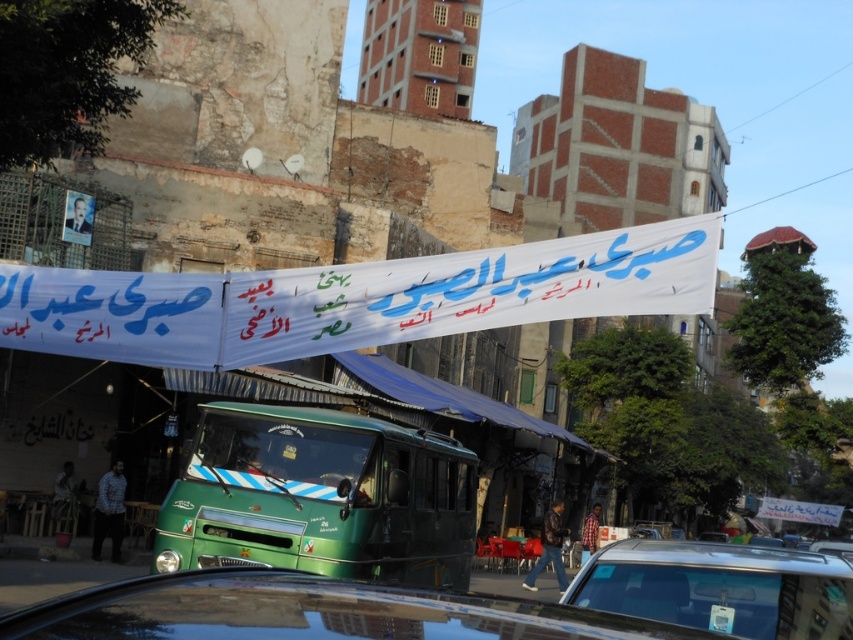
Is point (465, 472) closer to camera compared to point (650, 589)?

No.

Is green matte bus at center positioned in front of shiny black car at lower right?

No, it is behind shiny black car at lower right.

Describe the element at coordinates (320, 497) in the screenshot. I see `green matte bus at center` at that location.

The width and height of the screenshot is (853, 640). Find the location of `green matte bus at center`. green matte bus at center is located at coordinates (320, 497).

Is point (680, 637) positioned before point (741, 604)?

Yes, it is in front of point (741, 604).

Describe the element at coordinates (306, 612) in the screenshot. The height and width of the screenshot is (640, 853). I see `glossy black car at center` at that location.

The image size is (853, 640). I want to click on glossy black car at center, so click(306, 612).

Is green matte bus at center to the right of glossy black car at center from the viewer's perspective?

In fact, green matte bus at center is to the left of glossy black car at center.

Who is more forward, [236,456] or [401,589]?

Point [401,589] is more forward.

You are a GUI agent. You are given a task and a screenshot of the screen. Output one action in this format:
    pyautogui.click(x=<x>, y=<y>)
    Task: Click on the green matte bus at center
    
    Given the screenshot: What is the action you would take?
    pyautogui.click(x=320, y=497)